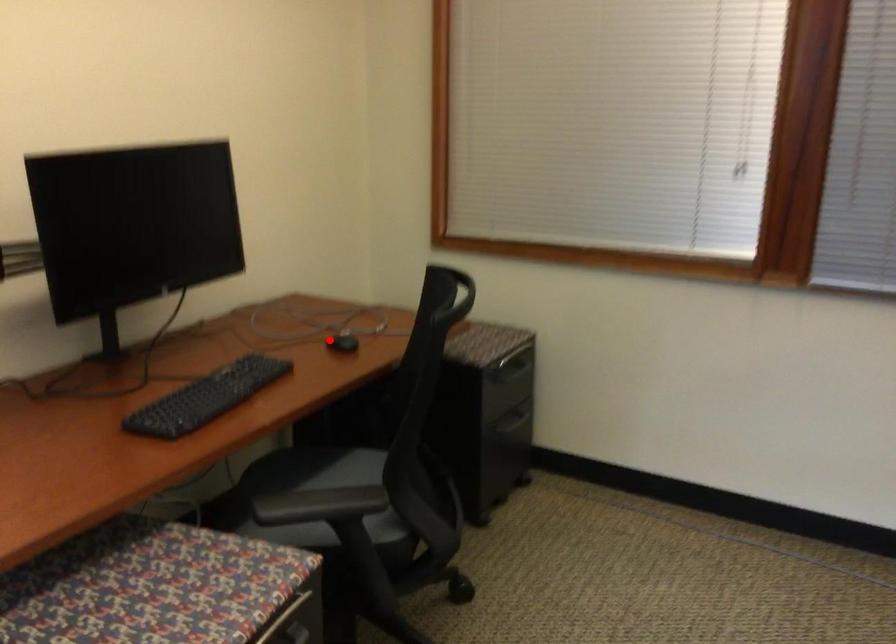
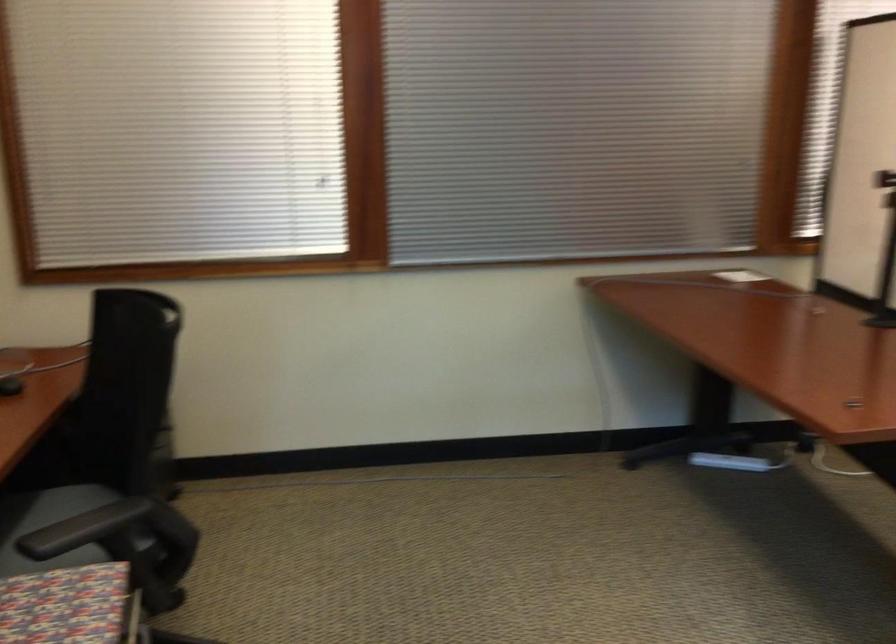
Question: I am providing you with two images of the same scene from different viewpoints. A red point is marked on the first image. Is the red point's position out of view in image 2?

Choices:
 (A) Yes
 (B) No

Answer: (B)